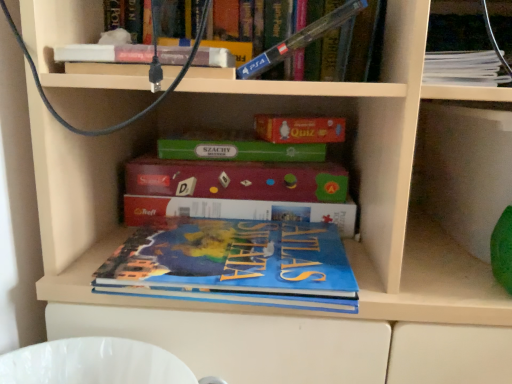
Question: From a real-world perspective, is white paper stack at upper right, which ranks as the fourth book in bottom-to-top order, positioned above or below blue matte atlas book at center, positioned as the fourth book in top-to-bottom order?

Choices:
 (A) above
 (B) below

Answer: (A)

Question: Based on their sizes in the image, would you say white paper stack at upper right, the 1th book viewed from the top, is bigger or smaller than blue matte atlas book at center, placed as the 1th book when sorted from bottom to top?

Choices:
 (A) small
 (B) big

Answer: (A)

Question: Which is nearer to the white paper stack at upper right, which ranks as the fourth book in bottom-to-top order?

Choices:
 (A) blue cardboard puzzle at center, the 3th book viewed from the top
 (B) blue matte atlas book at center, placed as the 1th book when sorted from bottom to top
 (C) blue plastic ps4 controller at upper center, acting as the third book starting from the bottom

Answer: (C)

Question: Which of these objects is positioned closest to the blue cardboard puzzle at center, the 3th book viewed from the top?

Choices:
 (A) blue plastic ps4 controller at upper center, acting as the third book starting from the bottom
 (B) white paper stack at upper right, which ranks as the fourth book in bottom-to-top order
 (C) blue matte atlas book at center, positioned as the fourth book in top-to-bottom order

Answer: (C)